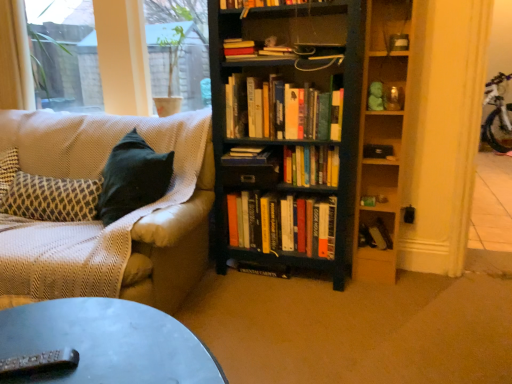
Question: Considering the relative sizes of transparent glass window at upper left, which ranks as the 2th window screen in right-to-left order, and metallic gray remote control at lower left in the image provided, is transparent glass window at upper left, which ranks as the 2th window screen in right-to-left order, taller than metallic gray remote control at lower left?

Choices:
 (A) no
 (B) yes

Answer: (B)

Question: Is transparent glass window at upper left, acting as the first window screen starting from the left, at the left side of metallic gray remote control at lower left?

Choices:
 (A) no
 (B) yes

Answer: (B)

Question: From a real-world perspective, is transparent glass window at upper left, acting as the first window screen starting from the left, located higher than metallic gray remote control at lower left?

Choices:
 (A) yes
 (B) no

Answer: (A)

Question: Is transparent glass window at upper left, acting as the first window screen starting from the left, positioned beyond the bounds of metallic gray remote control at lower left?

Choices:
 (A) yes
 (B) no

Answer: (A)

Question: Can metallic gray remote control at lower left be found inside transparent glass window at upper left, acting as the first window screen starting from the left?

Choices:
 (A) yes
 (B) no

Answer: (B)

Question: From the image's perspective, would you say transparent glass window at upper left, which ranks as the 2th window screen in right-to-left order, is positioned over metallic gray remote control at lower left?

Choices:
 (A) yes
 (B) no

Answer: (A)

Question: Is wooden shelf at upper right, which is the 1th shelf in top-to-bottom order, in contact with hardcover books at center, the 2th book when ordered from bottom to top?

Choices:
 (A) no
 (B) yes

Answer: (A)

Question: Is wooden shelf at upper right, which is the 1th shelf in top-to-bottom order, thinner than hardcover books at center, the 2th book when ordered from bottom to top?

Choices:
 (A) no
 (B) yes

Answer: (B)

Question: Is wooden shelf at upper right, the 2th shelf positioned from the bottom, facing away from hardcover books at center, arranged as the fifth book when viewed from the top?

Choices:
 (A) yes
 (B) no

Answer: (B)

Question: Is wooden shelf at upper right, which is the 1th shelf in top-to-bottom order, smaller than hardcover books at center, arranged as the fifth book when viewed from the top?

Choices:
 (A) no
 (B) yes

Answer: (B)

Question: Could you tell me if wooden shelf at upper right, which is the 1th shelf in top-to-bottom order, is turned towards hardcover books at center, the 2th book when ordered from bottom to top?

Choices:
 (A) no
 (B) yes

Answer: (A)

Question: From the image's perspective, is wooden shelf at upper right, the 2th shelf positioned from the bottom, under hardcover books at center, the 2th book when ordered from bottom to top?

Choices:
 (A) no
 (B) yes

Answer: (A)

Question: From the image's perspective, would you say dark wood bookcase at center is shown under metallic gray remote control at lower left?

Choices:
 (A) no
 (B) yes

Answer: (A)